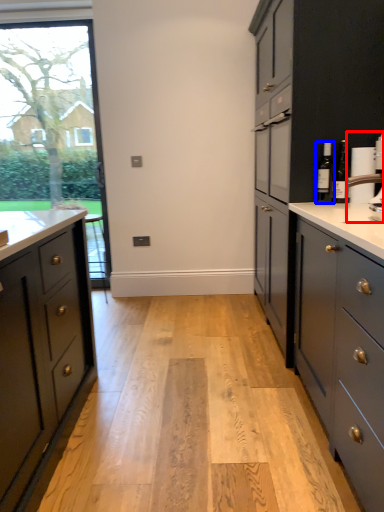
Question: Which object is closer to the camera taking this photo, coffee machine (highlighted by a red box) or bottle (highlighted by a blue box)?

Choices:
 (A) coffee machine
 (B) bottle

Answer: (A)